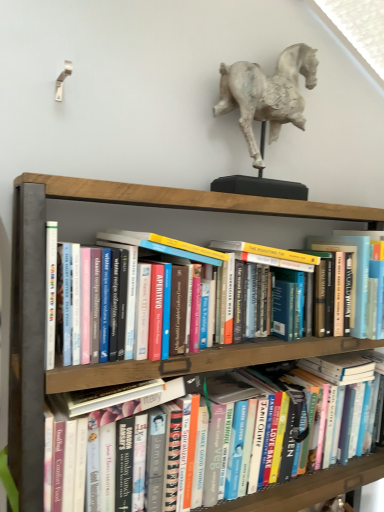
Question: From the image's perspective, is white plaster horse at upper center below wooden bookshelf at center?

Choices:
 (A) no
 (B) yes

Answer: (A)

Question: Considering the relative sizes of white plaster horse at upper center and wooden bookshelf at center in the image provided, is white plaster horse at upper center shorter than wooden bookshelf at center?

Choices:
 (A) yes
 (B) no

Answer: (A)

Question: Would you say white plaster horse at upper center is a long distance from wooden bookshelf at center?

Choices:
 (A) no
 (B) yes

Answer: (A)

Question: Does white plaster horse at upper center contain wooden bookshelf at center?

Choices:
 (A) no
 (B) yes

Answer: (A)

Question: Does white plaster horse at upper center come behind wooden bookshelf at center?

Choices:
 (A) no
 (B) yes

Answer: (B)

Question: In the image, is hardcover book at center on the left side or the right side of white plaster horse at upper center?

Choices:
 (A) right
 (B) left

Answer: (A)

Question: From their relative heights in the image, would you say hardcover book at center is taller or shorter than white plaster horse at upper center?

Choices:
 (A) tall
 (B) short

Answer: (B)

Question: Considering the positions of hardcover book at center and white plaster horse at upper center in the image, is hardcover book at center bigger or smaller than white plaster horse at upper center?

Choices:
 (A) big
 (B) small

Answer: (A)

Question: From the image's perspective, relative to white plaster horse at upper center, is hardcover book at center above or below?

Choices:
 (A) below
 (B) above

Answer: (A)

Question: Is wooden bookshelf at center taller or shorter than white plaster horse at upper center?

Choices:
 (A) tall
 (B) short

Answer: (A)

Question: Do you think wooden bookshelf at center is within white plaster horse at upper center, or outside of it?

Choices:
 (A) inside
 (B) outside

Answer: (B)

Question: From the image's perspective, is wooden bookshelf at center above or below white plaster horse at upper center?

Choices:
 (A) above
 (B) below

Answer: (B)

Question: Is point (365, 475) closer or farther from the camera than point (276, 114)?

Choices:
 (A) closer
 (B) farther

Answer: (B)

Question: From the image's perspective, is white plaster horse at upper center located above or below wooden bookshelf at center?

Choices:
 (A) above
 (B) below

Answer: (A)

Question: From a real-world perspective, is white plaster horse at upper center physically located above or below wooden bookshelf at center?

Choices:
 (A) below
 (B) above

Answer: (B)